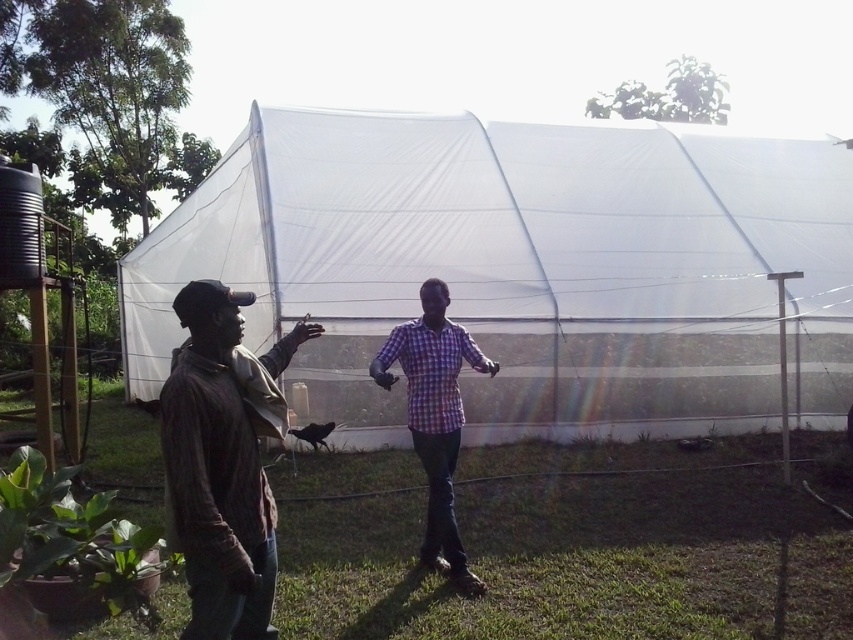
You are planning to set up a picnic area in the image. You have a transparent plastic tent at center and a checkered fabric shirt at center. Which object is above the other?

The transparent plastic tent at center is positioned over the checkered fabric shirt at center, so the tent is above the shirt.

You are planning to set up a tent in your backyard and want to ensure there is enough vertical space for your activities. You have a checkered fabric shirt that you plan to wear. Considering the scene, can you determine if the transparent plastic tent at center would provide enough vertical clearance for someone wearing the checkered fabric shirt at center?

The transparent plastic tent at center is much taller than the checkered fabric shirt at center, so it should provide sufficient vertical clearance for someone wearing the checkered fabric shirt at center.

You are trying to locate the transparent plastic tent at center in the image. According to the scene description, where should you look relative to the brown corduroy jacket at center?

A: The transparent plastic tent at center is to the right of the brown corduroy jacket at center.